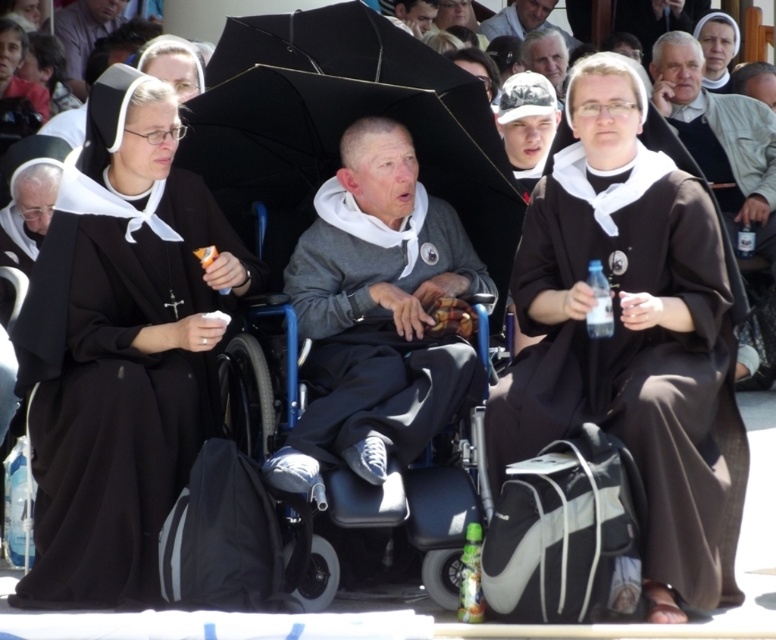
Question: Among these objects, which one is nearest to the camera?

Choices:
 (A) gray fleece hoodie at center
 (B) matte black wheelchair at upper center
 (C) black matte nun's habit at left
 (D) brown matte nun at center

Answer: (A)

Question: Which of the following is the closest to the observer?

Choices:
 (A) (111, 451)
 (B) (82, 28)
 (C) (331, 49)

Answer: (A)

Question: Is brown matte nun at center further to camera compared to matte black robe at left?

Choices:
 (A) no
 (B) yes

Answer: (A)

Question: Can you confirm if black matte umbrella at center is positioned above matte black wheelchair at upper center?

Choices:
 (A) yes
 (B) no

Answer: (B)

Question: Can you confirm if brown matte nun at center is smaller than smooth gray hair at upper center?

Choices:
 (A) no
 (B) yes

Answer: (A)

Question: Which point is closer to the camera?

Choices:
 (A) (82, 1)
 (B) (539, 19)
 (C) (563, 60)
 (D) (473, 237)

Answer: (D)